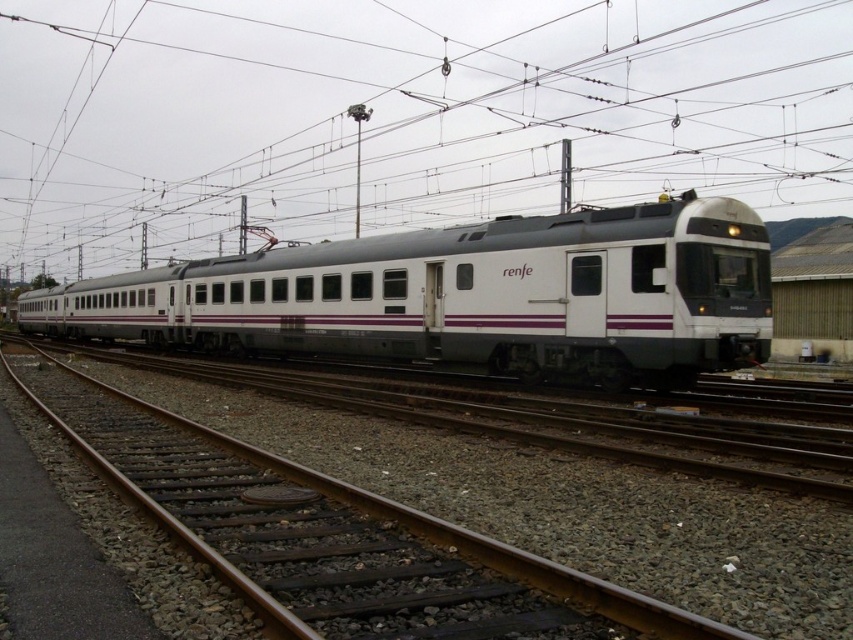
What is located at the coordinates point (399, 115) in the image?

The point (399, 115) marks a metallic wire at upper center.

You are a passenger waiting at the train station and see both the white matte train at center and the metallic gray train at center. Which train appears closer to you?

The white matte train at center appears closer to you because it is positioned closer to the viewer than the metallic gray train at center.